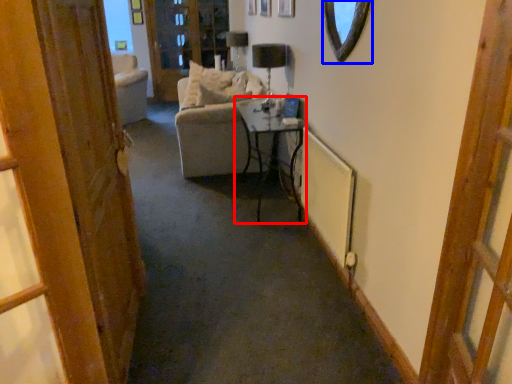
Question: Which of the following is the closest to the observer, table (highlighted by a red box) or mirror (highlighted by a blue box)?

Choices:
 (A) table
 (B) mirror

Answer: (B)